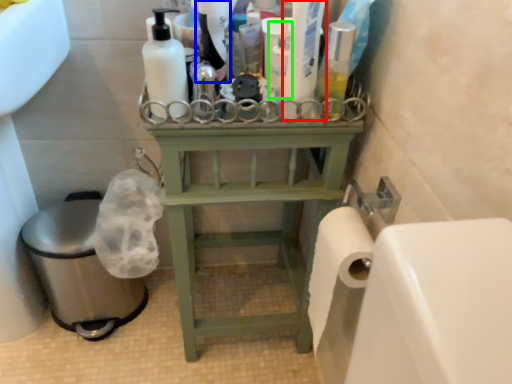
Question: Which object is the closest to the cleaning product (highlighted by a red box)? Choose among these: cleaning product (highlighted by a blue box) or cleaning product (highlighted by a green box).

Choices:
 (A) cleaning product
 (B) cleaning product

Answer: (B)